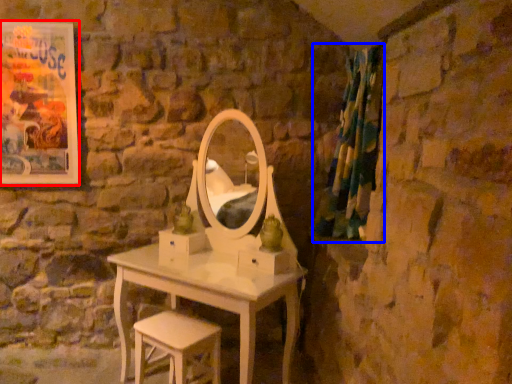
Question: Which point is closer to the camera, picture frame (highlighted by a red box) or curtain (highlighted by a blue box)?

Choices:
 (A) picture frame
 (B) curtain

Answer: (B)